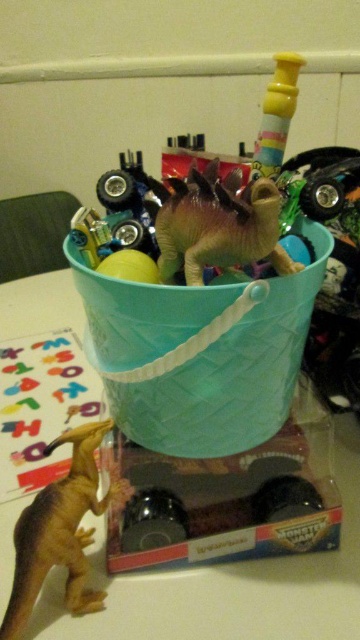
Question: Is matte plastic table at lower left positioned behind yellow matte dinosaur at lower left?

Choices:
 (A) no
 (B) yes

Answer: (B)

Question: Is matte plastic table at lower left smaller than yellow matte dinosaur at lower left?

Choices:
 (A) no
 (B) yes

Answer: (A)

Question: Which object appears farthest from the camera in this image?

Choices:
 (A) yellow matte dinosaur at lower left
 (B) matte plastic table at lower left

Answer: (B)

Question: Can you confirm if matte plastic table at lower left is positioned to the right of yellow matte dinosaur at lower left?

Choices:
 (A) no
 (B) yes

Answer: (A)

Question: Among these objects, which one is nearest to the camera?

Choices:
 (A) matte plastic table at lower left
 (B) yellow matte dinosaur at lower left

Answer: (B)